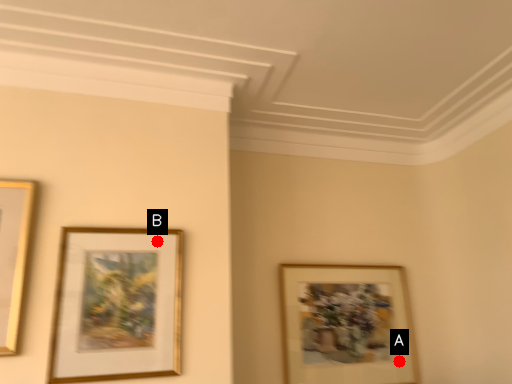
Question: Two points are circled on the image, labeled by A and B beside each circle. Which point is farther from the camera taking this photo?

Choices:
 (A) A is further
 (B) B is further

Answer: (A)